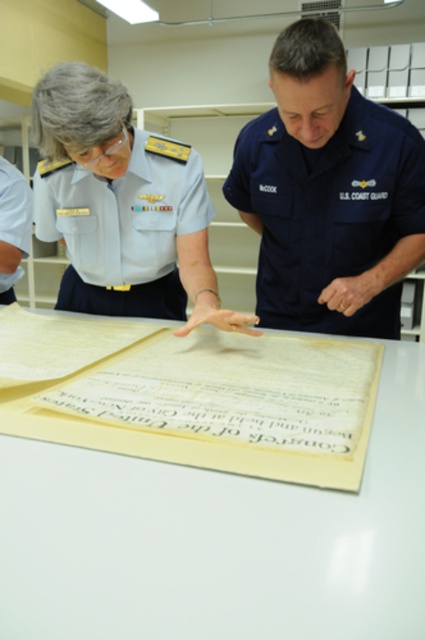
In the scene shown: You are a photographer in the museum. You want to take a photo of the framed document. The document is at point (346,230). You are standing 3.97 feet away from the document. Can you focus on the document clearly?

Yes, because the point (346,230) is 3.97 feet from the camera, which is within the typical focusing range of most cameras.

You are an observer in the museum. You see two uniforms at the upper left corner of the image. The first is labeled as white glossy uniform at upper left and the second as white fabric uniform at upper left. Which uniform is wider?

The white glossy uniform at upper left is wider than the white fabric uniform at upper left according to the description.

You are standing in the museum and see two points marked in the image. The first point is at coordinates point (158,154) and the second is at point (10,269). Which point is closer to you?

Point (158,154) is closer to the camera than point (10,269).